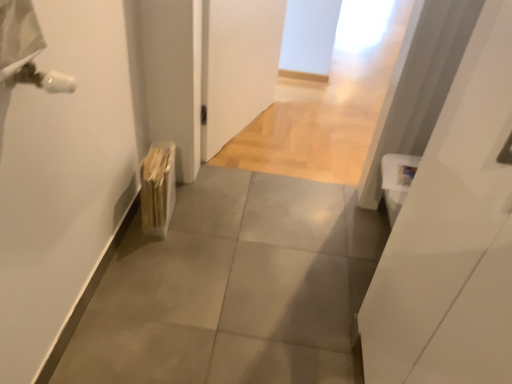
Question: From a real-world perspective, is white glossy door at right located higher than wooden radiator at lower left?

Choices:
 (A) no
 (B) yes

Answer: (B)

Question: Is white glossy door at right closer to the viewer compared to wooden radiator at lower left?

Choices:
 (A) yes
 (B) no

Answer: (A)

Question: From the image's perspective, would you say white glossy door at right is shown under wooden radiator at lower left?

Choices:
 (A) yes
 (B) no

Answer: (A)

Question: Is white glossy door at right at the left side of wooden radiator at lower left?

Choices:
 (A) no
 (B) yes

Answer: (A)

Question: Considering the relative sizes of white glossy door at right and wooden radiator at lower left in the image provided, is white glossy door at right bigger than wooden radiator at lower left?

Choices:
 (A) no
 (B) yes

Answer: (B)

Question: Is point (161, 180) closer or farther from the camera than point (204, 354)?

Choices:
 (A) closer
 (B) farther

Answer: (B)

Question: Do you think wooden radiator at lower left is within gray tile floor at center, or outside of it?

Choices:
 (A) inside
 (B) outside

Answer: (B)

Question: From the image's perspective, relative to gray tile floor at center, is wooden radiator at lower left above or below?

Choices:
 (A) above
 (B) below

Answer: (A)

Question: Is wooden radiator at lower left in front of or behind gray tile floor at center in the image?

Choices:
 (A) behind
 (B) front

Answer: (A)

Question: Based on their positions, is gray tile floor at center located to the left or right of wooden radiator at lower left?

Choices:
 (A) left
 (B) right

Answer: (B)

Question: Which is correct: gray tile floor at center is inside wooden radiator at lower left, or outside of it?

Choices:
 (A) inside
 (B) outside

Answer: (B)

Question: Looking at the image, does gray tile floor at center seem bigger or smaller compared to wooden radiator at lower left?

Choices:
 (A) big
 (B) small

Answer: (A)

Question: From the image's perspective, is gray tile floor at center located above or below wooden radiator at lower left?

Choices:
 (A) above
 (B) below

Answer: (B)

Question: Based on their positions, is white glossy door at right located to the left or right of gray tile floor at center?

Choices:
 (A) left
 (B) right

Answer: (B)

Question: From a real-world perspective, is white glossy door at right positioned above or below gray tile floor at center?

Choices:
 (A) above
 (B) below

Answer: (A)